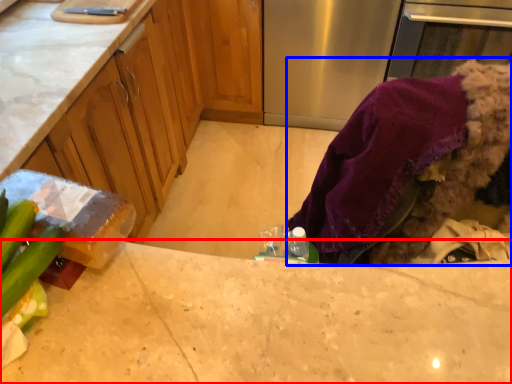
Question: Which point is further to the camera, countertop (highlighted by a red box) or clothing (highlighted by a blue box)?

Choices:
 (A) countertop
 (B) clothing

Answer: (B)